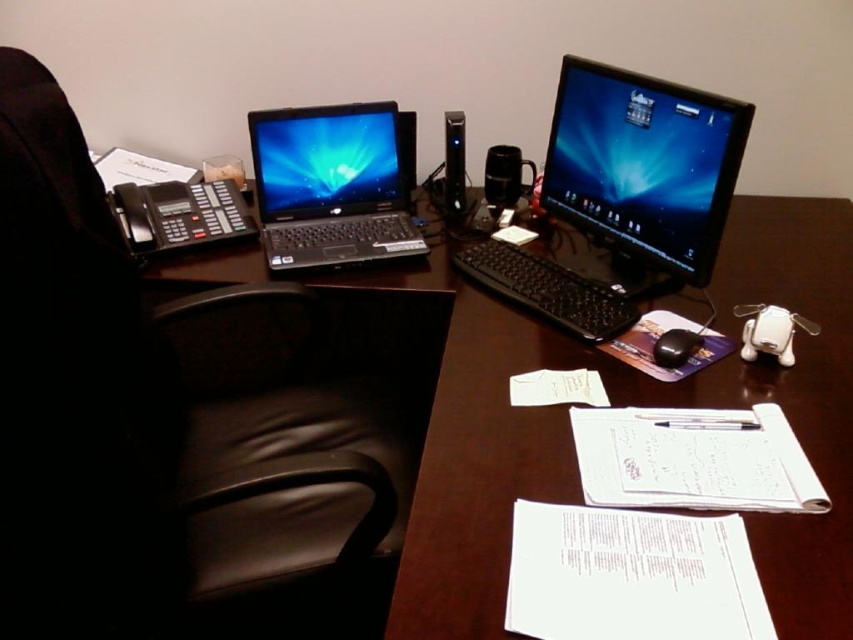
Does point (323, 266) come closer to viewer compared to point (520, 257)?

Yes.

Does shiny black laptop at left appear on the right side of black plastic keyboard at center?

No, shiny black laptop at left is not to the right of black plastic keyboard at center.

What do you see at coordinates (329, 186) in the screenshot? I see `shiny black laptop at left` at bounding box center [329, 186].

Locate an element on the screen. The image size is (853, 640). shiny black laptop at left is located at coordinates (329, 186).

Does satin black monitor at center appear on the left side of black plastic keyboard at center?

In fact, satin black monitor at center is to the right of black plastic keyboard at center.

Which is more to the right, satin black monitor at center or black plastic keyboard at center?

satin black monitor at center is more to the right.

Which is behind, point (611, 173) or point (537, 289)?

Positioned behind is point (611, 173).

I want to click on satin black monitor at center, so click(642, 173).

Can you confirm if satin black monitor at center is positioned above black plastic speaker at center?

Actually, satin black monitor at center is below black plastic speaker at center.

Is point (602, 218) farther from viewer compared to point (451, 144)?

No.

In order to click on satin black monitor at center in this screenshot , I will do (642, 173).